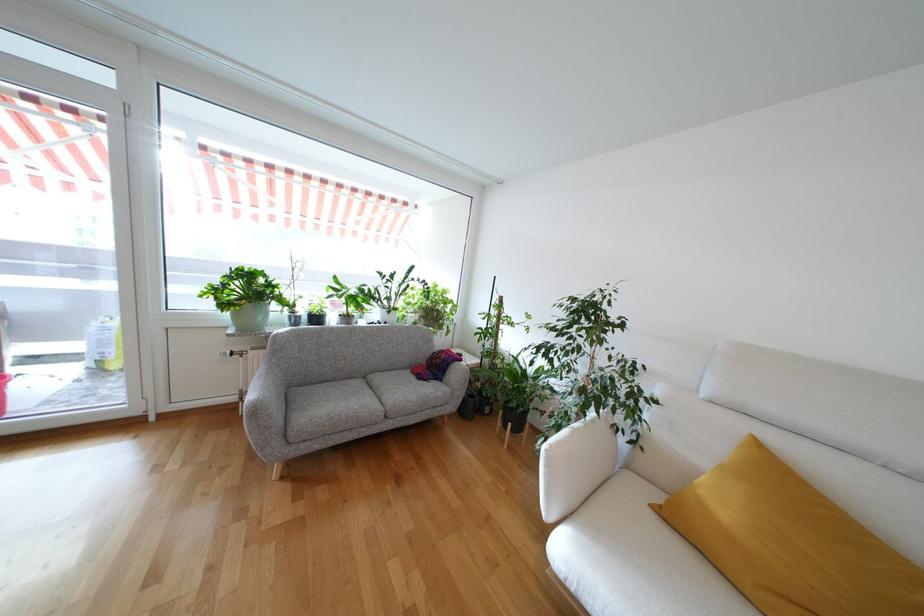
The height and width of the screenshot is (616, 924). Describe the element at coordinates (225, 353) in the screenshot. I see `the white radiator knob` at that location.